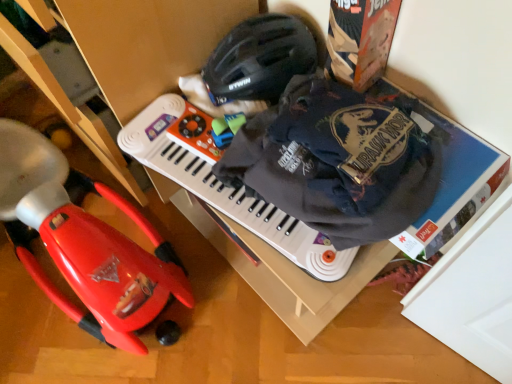
What do you see at coordinates (84, 243) in the screenshot? The width and height of the screenshot is (512, 384). I see `red plastic toy car at left` at bounding box center [84, 243].

Locate an element on the screen. The width and height of the screenshot is (512, 384). black matte helmet at upper center is located at coordinates (260, 59).

This screenshot has width=512, height=384. Find the location of `red plastic toy car at left`. red plastic toy car at left is located at coordinates (84, 243).

Is white plastic musical keyboard at center to the left of red plastic toy car at left from the viewer's perspective?

Incorrect, white plastic musical keyboard at center is not on the left side of red plastic toy car at left.

Is white plastic musical keyboard at center taller or shorter than red plastic toy car at left?

Clearly, white plastic musical keyboard at center is shorter compared to red plastic toy car at left.

Is white plastic musical keyboard at center inside or outside of red plastic toy car at left?

white plastic musical keyboard at center is not enclosed by red plastic toy car at left.

From the picture: Would you say dark blue cotton t-shirt at upper right is a long distance from black matte helmet at upper center?

No.

Which is in front, dark blue cotton t-shirt at upper right or black matte helmet at upper center?

dark blue cotton t-shirt at upper right is closer to the camera.

Is dark blue cotton t-shirt at upper right positioned with its back to black matte helmet at upper center?

That's not correct — dark blue cotton t-shirt at upper right is not looking away from black matte helmet at upper center.

Would you say black matte helmet at upper center is a long distance from dark blue cotton t-shirt at upper right?

No, there isn't a large distance between black matte helmet at upper center and dark blue cotton t-shirt at upper right.

Where is `waste lying on the right of black matte helmet at upper center`? This screenshot has height=384, width=512. waste lying on the right of black matte helmet at upper center is located at coordinates (338, 161).

Considering the relative positions of black matte helmet at upper center and dark blue cotton t-shirt at upper right in the image provided, is black matte helmet at upper center to the right of dark blue cotton t-shirt at upper right from the viewer's perspective?

No.

Is black matte helmet at upper center positioned beyond the bounds of dark blue cotton t-shirt at upper right?

That's correct, black matte helmet at upper center is outside of dark blue cotton t-shirt at upper right.

Does point (359, 95) come closer to viewer compared to point (182, 281)?

Yes.

How many degrees apart are the facing directions of dark blue cotton t-shirt at upper right and red plastic toy car at left?

82.1 degrees separate the facing orientations of dark blue cotton t-shirt at upper right and red plastic toy car at left.

Is dark blue cotton t-shirt at upper right at the right side of red plastic toy car at left?

Yes, dark blue cotton t-shirt at upper right is to the right of red plastic toy car at left.

Is dark blue cotton t-shirt at upper right touching red plastic toy car at left?

No, dark blue cotton t-shirt at upper right is not beside red plastic toy car at left.

From a real-world perspective, is red plastic toy car at left positioned above or below white plastic musical keyboard at center?

From a real-world perspective, red plastic toy car at left is physically below white plastic musical keyboard at center.

Is red plastic toy car at left further to camera compared to white plastic musical keyboard at center?

No, the depth of red plastic toy car at left is less than that of white plastic musical keyboard at center.

From their relative heights in the image, would you say red plastic toy car at left is taller or shorter than white plastic musical keyboard at center?

Clearly, red plastic toy car at left is taller compared to white plastic musical keyboard at center.

In the scene shown: Which point is more forward, [208,60] or [119,309]?

The point [119,309] is in front.

From the image's perspective, which is above, black matte helmet at upper center or red plastic toy car at left?

black matte helmet at upper center, from the image's perspective.

Are black matte helmet at upper center and red plastic toy car at left beside each other?

black matte helmet at upper center and red plastic toy car at left are clearly separated.

Is red plastic toy car at left positioned before black matte helmet at upper center?

Yes, red plastic toy car at left is closer to the viewer.

Identify the location of helmet on the right of red plastic toy car at left. Image resolution: width=512 pixels, height=384 pixels. (260, 59).

From the image's perspective, which is above, red plastic toy car at left or black matte helmet at upper center?

black matte helmet at upper center.

Would you say red plastic toy car at left is to the left or to the right of black matte helmet at upper center in the picture?

Based on their positions, red plastic toy car at left is located to the left of black matte helmet at upper center.

Locate an element on the screen. This screenshot has height=384, width=512. toy below the white plastic musical keyboard at center (from a real-world perspective) is located at coordinates (84, 243).

I want to click on helmet that is on the left side of dark blue cotton t-shirt at upper right, so click(x=260, y=59).

From the image, which object appears to be nearer to red plastic toy car at left, white plastic musical keyboard at center or black matte helmet at upper center?

white plastic musical keyboard at center is positioned closer to the anchor red plastic toy car at left.

Which object lies further to the anchor point dark blue cotton t-shirt at upper right, black matte helmet at upper center or red plastic toy car at left?

Among the two, red plastic toy car at left is located further to dark blue cotton t-shirt at upper right.

In the scene shown: Which object lies nearer to the anchor point black matte helmet at upper center, dark blue cotton t-shirt at upper right or white plastic musical keyboard at center?

Based on the image, white plastic musical keyboard at center appears to be nearer to black matte helmet at upper center.

Based on their spatial positions, is dark blue cotton t-shirt at upper right or red plastic toy car at left further from white plastic musical keyboard at center?

Result: Among the two, red plastic toy car at left is located further to white plastic musical keyboard at center.

Which object lies further to the anchor point white plastic musical keyboard at center, dark blue cotton t-shirt at upper right or black matte helmet at upper center?

Among the two, black matte helmet at upper center is located further to white plastic musical keyboard at center.

When comparing their distances from red plastic toy car at left, does white plastic musical keyboard at center or dark blue cotton t-shirt at upper right seem further?

dark blue cotton t-shirt at upper right is further to red plastic toy car at left.

Which object lies further to the anchor point white plastic musical keyboard at center, red plastic toy car at left or dark blue cotton t-shirt at upper right?

Among the two, red plastic toy car at left is located further to white plastic musical keyboard at center.

Estimate the real-world distances between objects in this image. Which object is closer to dark blue cotton t-shirt at upper right, white plastic musical keyboard at center or black matte helmet at upper center?

white plastic musical keyboard at center is closer to dark blue cotton t-shirt at upper right.

This screenshot has width=512, height=384. In order to click on musical keyboard between red plastic toy car at left and dark blue cotton t-shirt at upper right in this screenshot , I will do `click(225, 186)`.

I want to click on helmet situated between red plastic toy car at left and dark blue cotton t-shirt at upper right from left to right, so click(x=260, y=59).

Find the location of `waste that lies between black matte helmet at upper center and white plastic musical keyboard at center from top to bottom`. waste that lies between black matte helmet at upper center and white plastic musical keyboard at center from top to bottom is located at coordinates (338, 161).

At what (x,y) coordinates should I click in order to perform the action: click on musical keyboard between red plastic toy car at left and black matte helmet at upper center in the horizontal direction. Please return your answer as a coordinate pair (x, y). Image resolution: width=512 pixels, height=384 pixels. Looking at the image, I should click on (225, 186).